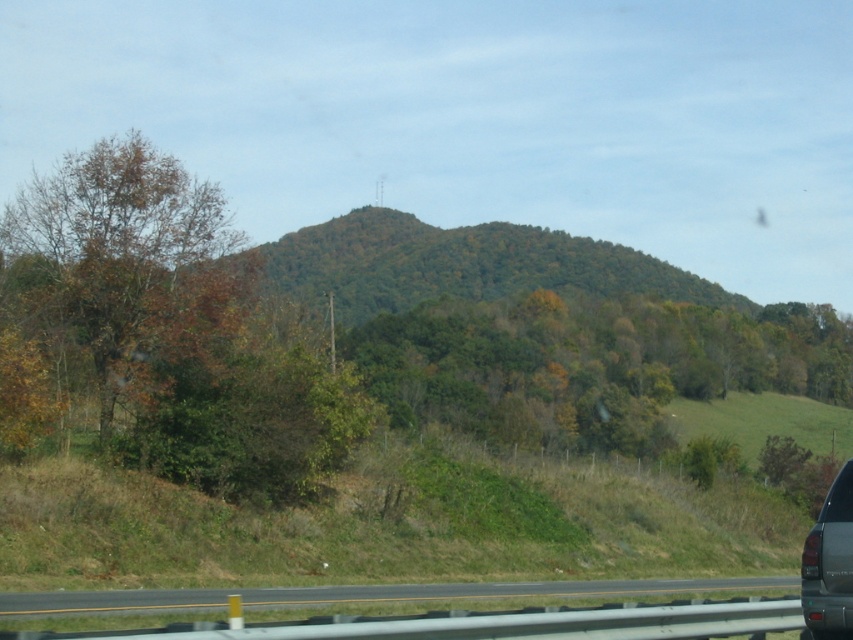
Between point (9, 369) and point (850, 499), which one is positioned in front?

Point (850, 499) is more forward.

Can you confirm if brown leafy tree at left is positioned to the left of metallic gray suv at lower right?

Correct, you'll find brown leafy tree at left to the left of metallic gray suv at lower right.

In order to click on brown leafy tree at left in this screenshot , I will do `click(105, 284)`.

Between brown leafy tree at left and black asphalt road at lower center, which one has more height?

Standing taller between the two is brown leafy tree at left.

Who is more distant from viewer, (136,157) or (56,589)?

The point (136,157) is behind.

I want to click on brown leafy tree at left, so (x=105, y=284).

This screenshot has height=640, width=853. Find the location of `brown leafy tree at left`. brown leafy tree at left is located at coordinates (105, 284).

Does black asphalt road at lower center appear on the right side of metallic gray suv at lower right?

Incorrect, black asphalt road at lower center is not on the right side of metallic gray suv at lower right.

At what (x,y) coordinates should I click in order to perform the action: click on black asphalt road at lower center. Please return your answer as a coordinate pair (x, y). This screenshot has width=853, height=640. Looking at the image, I should click on (363, 595).

Does point (149, 604) lie behind point (828, 490)?

No, it is in front of (828, 490).

Find the location of a particular element. black asphalt road at lower center is located at coordinates (363, 595).